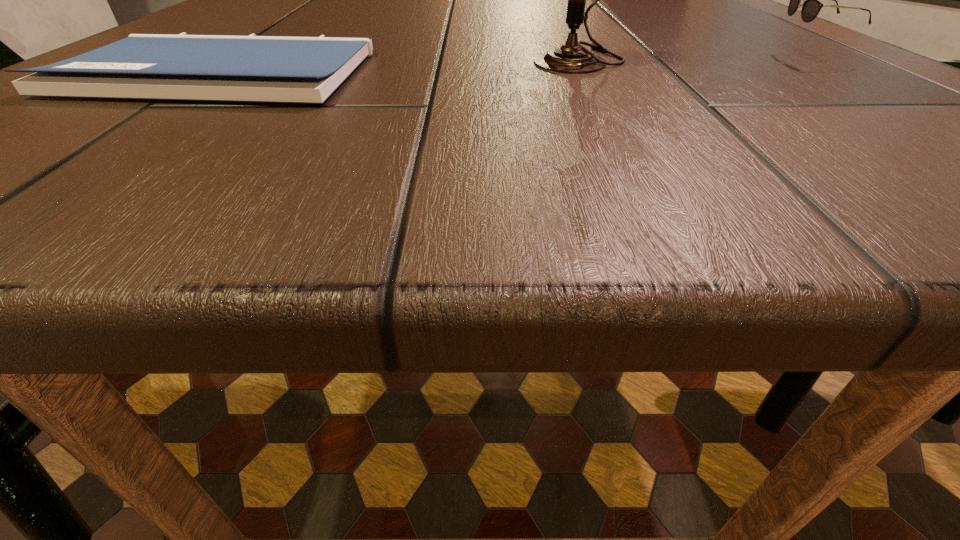
This screenshot has width=960, height=540. In order to click on vacant space located in front of the lenses of the rightmost object in this screenshot , I will do `click(434, 57)`.

Image resolution: width=960 pixels, height=540 pixels. Identify the location of vacant space situated in front of the lenses of the rightmost object. 683,57.

You are a GUI agent. You are given a task and a screenshot of the screen. Output one action in this format:
    pyautogui.click(x=<x>, y=<y>)
    Task: Click on the free location located on the back of the shortest object
    The width and height of the screenshot is (960, 540).
    Given the screenshot: What is the action you would take?
    pyautogui.click(x=276, y=35)

Locate an element on the screen. object located at the left edge is located at coordinates (243, 68).

Find the location of a particular element. object that is at the right edge is located at coordinates (812, 5).

I want to click on blank space at the near edge of the desktop, so click(x=283, y=163).

Find the location of `vacant area at the right edge`. vacant area at the right edge is located at coordinates (667, 28).

In order to click on empty space that is in between the tallest object and the second shortest object in this screenshot , I will do `click(692, 59)`.

Where is `blank region between the shortest object and the second shortest object`? blank region between the shortest object and the second shortest object is located at coordinates (514, 65).

Find the location of `free space that is in between the paperback book and the second shortest object`. free space that is in between the paperback book and the second shortest object is located at coordinates [514, 65].